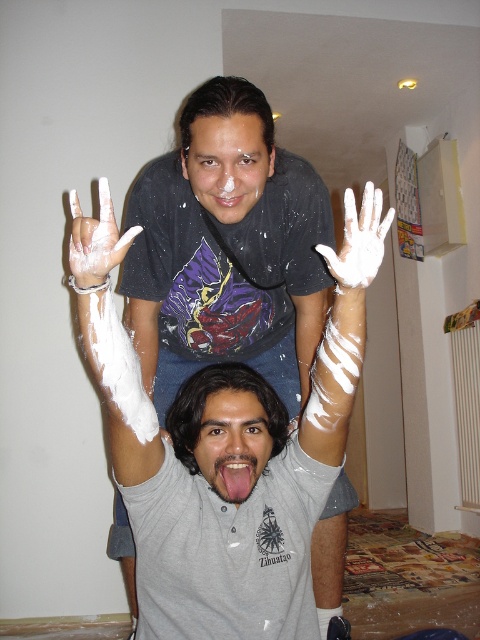
You are a photographer trying to capture the scene where the white matte shirt at center and the white matte hand at center are both visible. Based on their positions, which object should appear first from left to right in your photo?

The white matte shirt at center should appear first from left to right in the photo since it is positioned to the left of the white matte hand at center.

You are a photographer at a photoshoot. You need to ensure that the white matte shirt at center and the white matte face at center are visible in the final shot. Given their positions, which one is closer to the bottom of the frame?

The white matte shirt at center is below white matte face at center, so it is closer to the bottom of the frame.